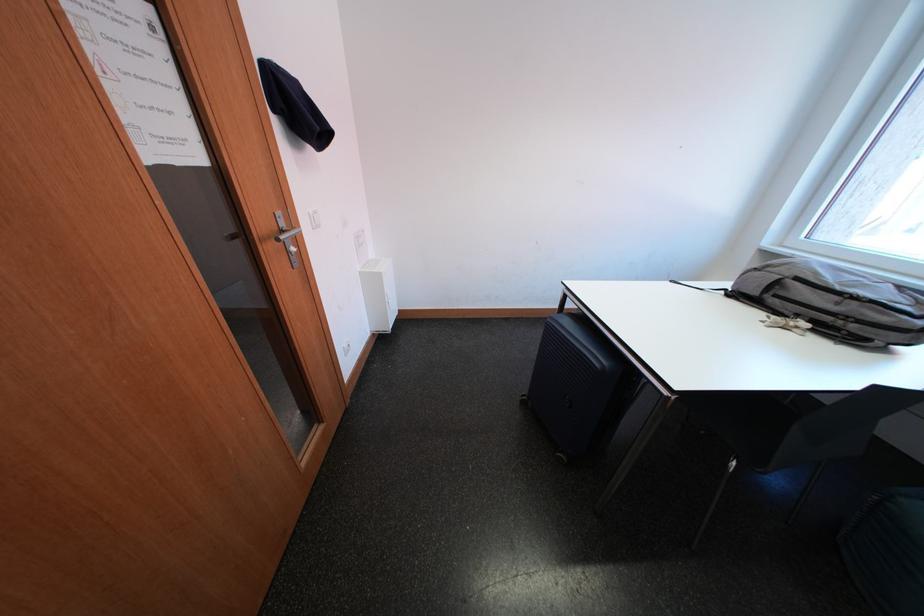
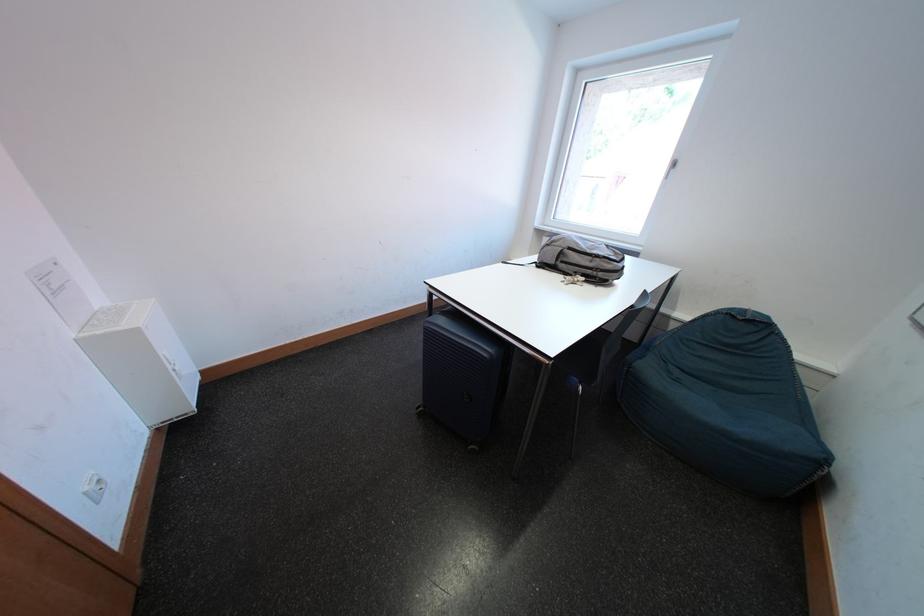
Where in the second image is the point corresponding to [610,363] from the first image?

(495, 353)